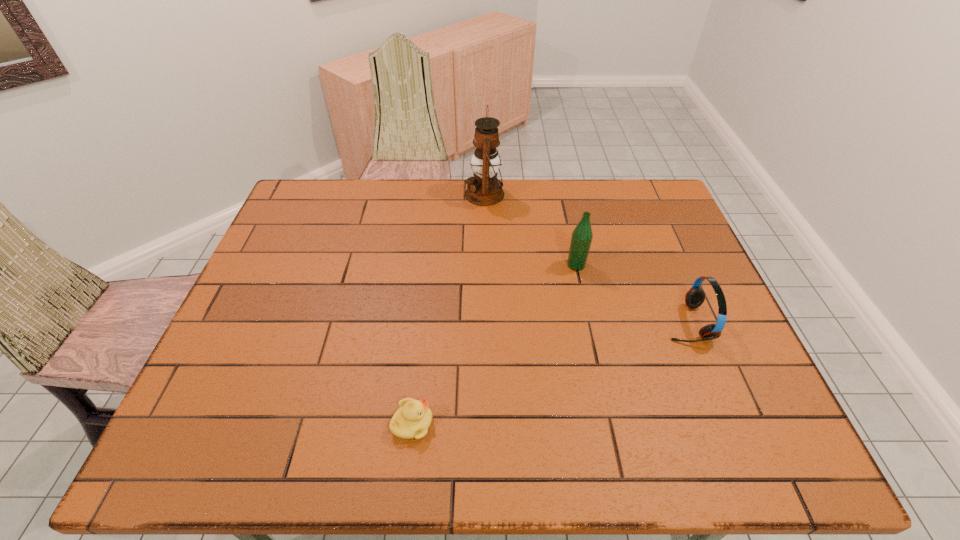
The width and height of the screenshot is (960, 540). I want to click on vacant space situated 0.060m on the side of the second object from left to right, there is a wick adjustment knob, so click(x=447, y=194).

Find the location of a particular element. This screenshot has height=540, width=960. vacant space positioned on the back of the bottle is located at coordinates [562, 199].

The height and width of the screenshot is (540, 960). I want to click on free space located 0.160m with the microphone attached to the side of the third farthest object, so click(602, 322).

Where is `free space located with the microphone attached to the side of the third farthest object`? This screenshot has width=960, height=540. free space located with the microphone attached to the side of the third farthest object is located at coordinates (554, 322).

This screenshot has height=540, width=960. Find the location of `free region located 0.090m with the microphone attached to the side of the third farthest object`. free region located 0.090m with the microphone attached to the side of the third farthest object is located at coordinates (629, 322).

At what (x,y) coordinates should I click in order to perform the action: click on free space located 0.240m on the beak of the leftmost object. Please return your answer as a coordinate pair (x, y). This screenshot has height=540, width=960. Looking at the image, I should click on (545, 423).

You are a GUI agent. You are given a task and a screenshot of the screen. Output one action in this format:
    pyautogui.click(x=<x>, y=<y>)
    Task: Click on the object situated at the far edge
    This screenshot has height=540, width=960.
    Given the screenshot: What is the action you would take?
    pyautogui.click(x=484, y=189)

Find the location of a particular element. This screenshot has width=960, height=540. object located in the near edge section of the desktop is located at coordinates (413, 418).

In order to click on object located in the right edge section of the desktop in this screenshot , I will do `click(695, 297)`.

In the image, there is a desktop. Find the location of `vacant space at the far edge`. vacant space at the far edge is located at coordinates (365, 201).